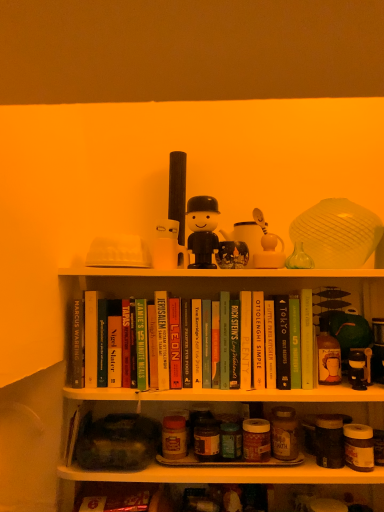
You are a GUI agent. You are given a task and a screenshot of the screen. Output one action in this format:
    pyautogui.click(x=<x>, y=<y>)
    Task: Click on the free location in front of hardcover book at center, the seventh paperback book in the right-to-left sequence
    The height and width of the screenshot is (512, 384).
    Given the screenshot: What is the action you would take?
    pyautogui.click(x=238, y=387)